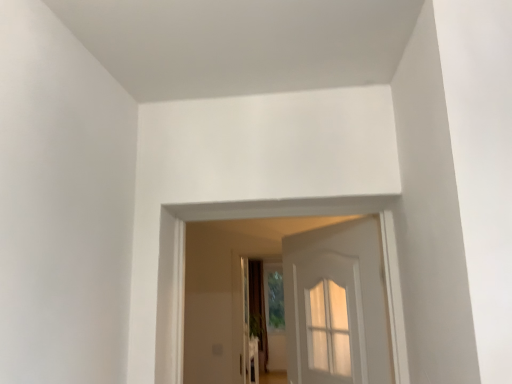
Question: From a real-world perspective, relative to brown fabric curtain at center, is white wooden door at center vertically above or below?

Choices:
 (A) below
 (B) above

Answer: (B)

Question: Considering their positions, is white wooden door at center located in front of or behind brown fabric curtain at center?

Choices:
 (A) front
 (B) behind

Answer: (A)

Question: Considering the relative positions of white wooden door at center and brown fabric curtain at center in the image provided, is white wooden door at center to the left or to the right of brown fabric curtain at center?

Choices:
 (A) right
 (B) left

Answer: (A)

Question: Based on their positions, is brown fabric curtain at center located to the left or right of white wooden door at center?

Choices:
 (A) left
 (B) right

Answer: (A)

Question: From a real-world perspective, is brown fabric curtain at center above or below white wooden door at center?

Choices:
 (A) below
 (B) above

Answer: (A)

Question: Considering the positions of brown fabric curtain at center and white wooden door at center in the image, is brown fabric curtain at center taller or shorter than white wooden door at center?

Choices:
 (A) tall
 (B) short

Answer: (A)

Question: From the image's perspective, is brown fabric curtain at center positioned above or below white wooden door at center?

Choices:
 (A) below
 (B) above

Answer: (A)